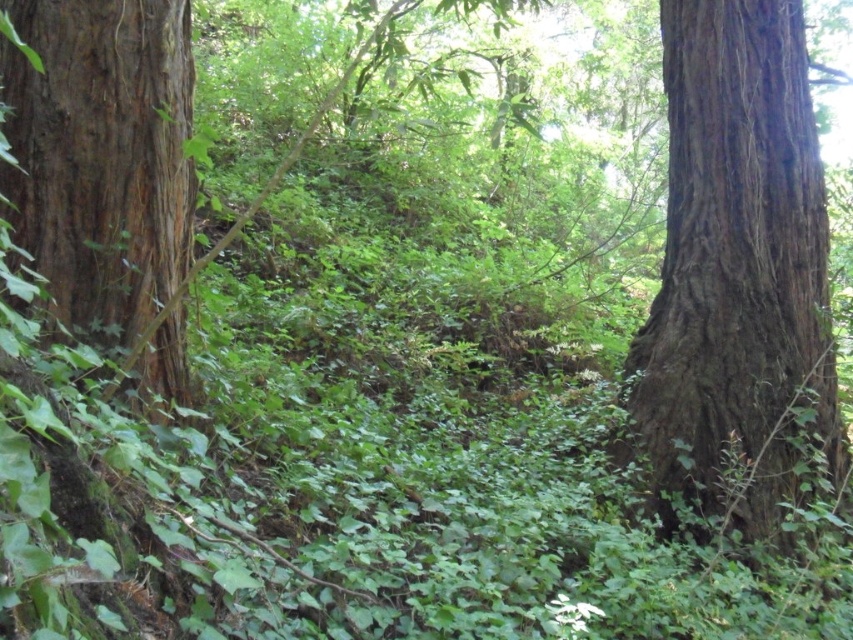
Does brown rough bark tree trunk at right appear over smooth brown bark at left?

Incorrect, brown rough bark tree trunk at right is not positioned above smooth brown bark at left.

Based on the photo, is brown rough bark tree trunk at right to the left of smooth brown bark at left from the viewer's perspective?

In fact, brown rough bark tree trunk at right is to the right of smooth brown bark at left.

Between point (672, 74) and point (83, 144), which one is positioned in front?

Point (83, 144) is more forward.

Image resolution: width=853 pixels, height=640 pixels. I want to click on brown rough bark tree trunk at right, so click(738, 276).